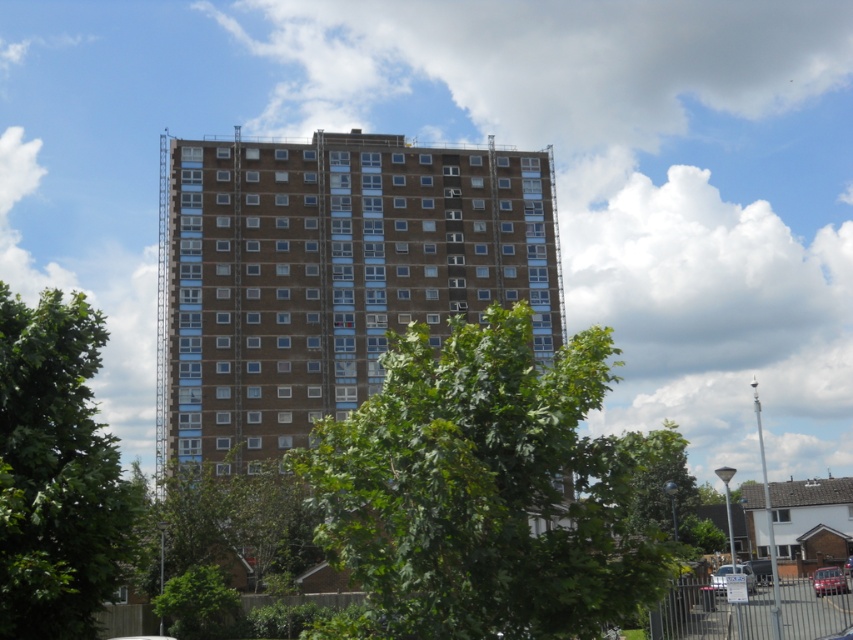
Can you confirm if green leafy tree at center is positioned above metallic silver car at center?

Correct, green leafy tree at center is located above metallic silver car at center.

Between green leafy tree at center and metallic silver car at center, which one appears on the right side from the viewer's perspective?

From the viewer's perspective, metallic silver car at center appears more on the right side.

Identify the location of green leafy tree at center. (483, 492).

Locate an element on the screen. green leafy tree at center is located at coordinates (483, 492).

Between green leafy tree at left and metallic red car at lower right, which one is positioned higher?

green leafy tree at left is above.

Can you confirm if green leafy tree at left is positioned above metallic red car at lower right?

Yes, green leafy tree at left is above metallic red car at lower right.

Does point (65, 404) lie behind point (843, 580)?

No, it is not.

Identify the location of green leafy tree at left. The height and width of the screenshot is (640, 853). (55, 472).

Which is below, green leafy tree at center or silver metallic car at lower right?

silver metallic car at lower right is lower down.

Is point (556, 518) farther from viewer compared to point (751, 589)?

No, (556, 518) is closer to viewer.

The height and width of the screenshot is (640, 853). I want to click on green leafy tree at center, so click(483, 492).